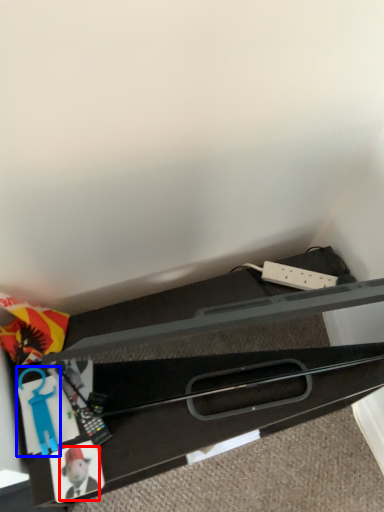
Question: Among these objects, which one is nearest to the camera, toy (highlighted by a red box) or toy (highlighted by a blue box)?

Choices:
 (A) toy
 (B) toy

Answer: (A)